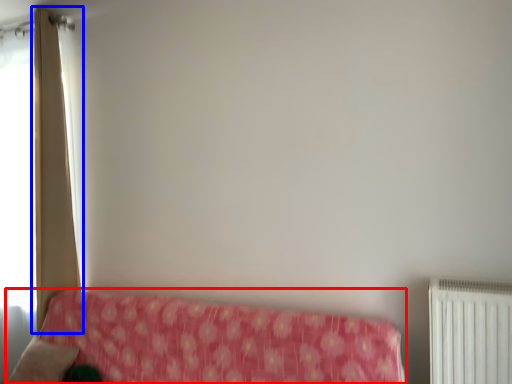
Question: Which object appears farthest to the camera in this image, furniture (highlighted by a red box) or curtain (highlighted by a blue box)?

Choices:
 (A) furniture
 (B) curtain

Answer: (B)